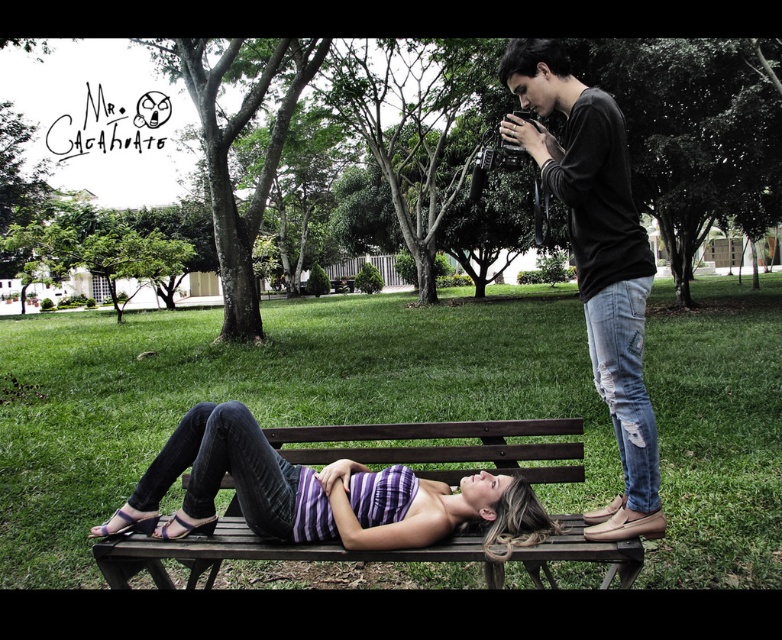
Question: Can you confirm if purple striped tank top at center is positioned to the left of black cotton shirt at upper right?

Choices:
 (A) no
 (B) yes

Answer: (B)

Question: Which of the following is the farthest from the observer?

Choices:
 (A) (608, 534)
 (B) (192, 520)

Answer: (B)

Question: Which of the following is the farthest from the observer?

Choices:
 (A) purple striped tank top at center
 (B) black cotton shirt at upper right

Answer: (B)

Question: Is purple striped tank top at center to the right of black cotton shirt at upper right from the viewer's perspective?

Choices:
 (A) yes
 (B) no

Answer: (B)

Question: Can you confirm if purple striped tank top at center is thinner than black cotton shirt at upper right?

Choices:
 (A) yes
 (B) no

Answer: (B)